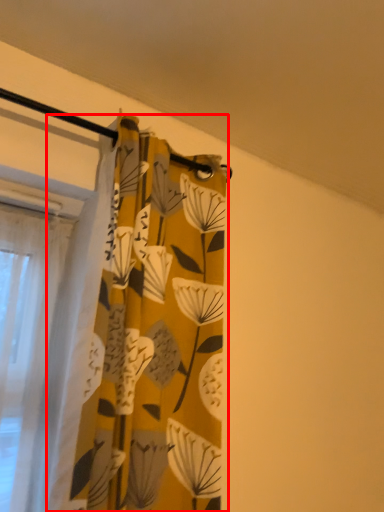
Question: From the image's perspective, considering the relative positions of curtain (annotated by the red box) and backdrop in the image provided, where is curtain (annotated by the red box) located with respect to the staircase?

Choices:
 (A) below
 (B) above

Answer: (A)